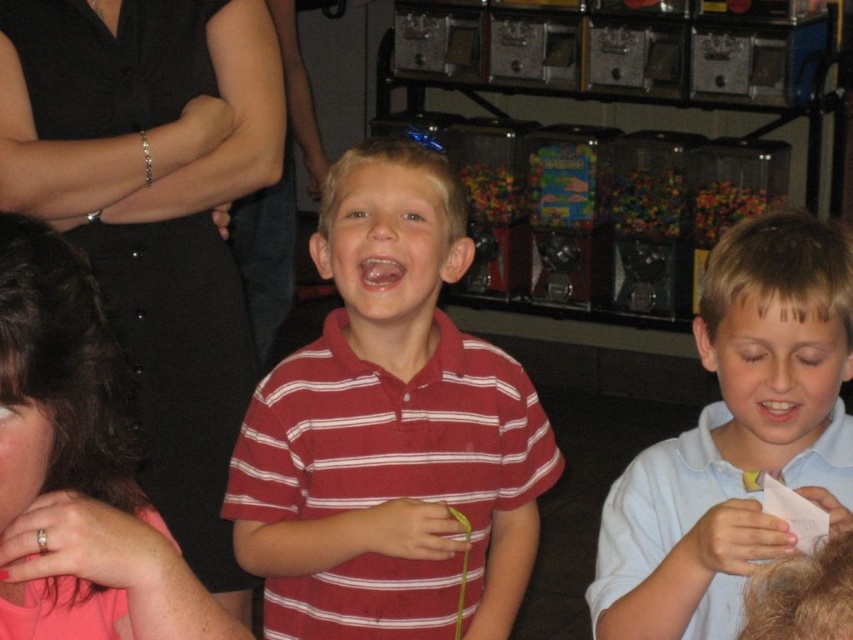
Question: Estimate the real-world distances between objects in this image. Which object is farther from the white cotton shirt at right?

Choices:
 (A) striped cotton shirt at center
 (B) pink matte shirt at lower left
 (C) translucent plastic candy at center

Answer: (C)

Question: Is striped cotton shirt at center above pink matte shirt at lower left?

Choices:
 (A) no
 (B) yes

Answer: (A)

Question: Can you confirm if translucent plastic gumballs at center is wider than translucent plastic candy at center?

Choices:
 (A) no
 (B) yes

Answer: (A)

Question: Can you confirm if translucent plastic gumballs at center is bigger than translucent plastic candy at center?

Choices:
 (A) yes
 (B) no

Answer: (B)

Question: Which of the following is the closest to the observer?

Choices:
 (A) (16, 268)
 (B) (784, 241)

Answer: (A)

Question: Based on their relative distances, which object is nearer to the translucent plastic candy at center?

Choices:
 (A) pink matte shirt at lower left
 (B) white cotton shirt at right

Answer: (B)